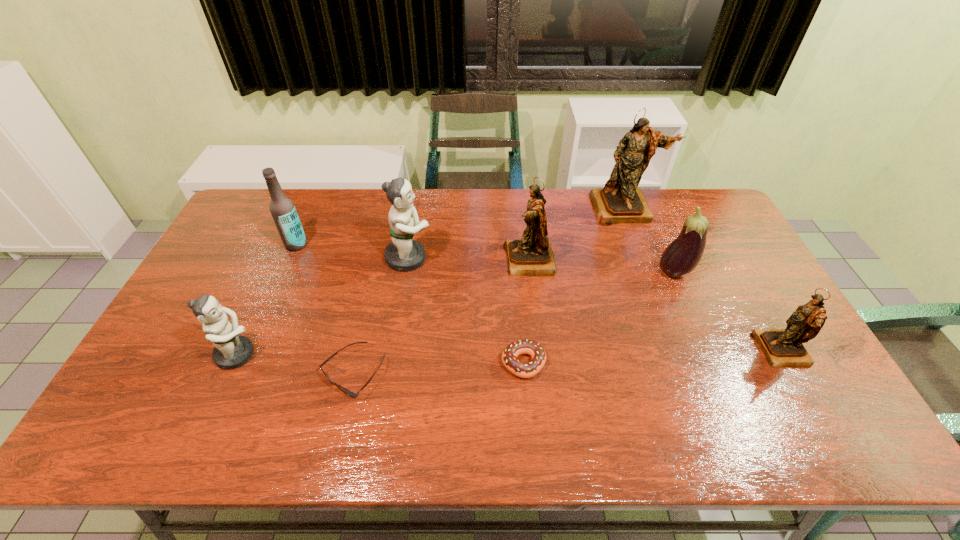
Where is `the farthest figurine`? This screenshot has height=540, width=960. the farthest figurine is located at coordinates (621, 200).

This screenshot has height=540, width=960. In order to click on the second figurine from right to left in this screenshot , I will do `click(621, 200)`.

This screenshot has height=540, width=960. Identify the location of the right green figurine. (403, 254).

In order to click on the bigger green figurine in this screenshot , I will do `click(403, 254)`.

You are a GUI agent. You are given a task and a screenshot of the screen. Output one action in this format:
    pyautogui.click(x=<x>, y=<y>)
    Task: Click on the second smallest gold figurine
    Image resolution: width=960 pixels, height=540 pixels.
    Given the screenshot: What is the action you would take?
    pyautogui.click(x=532, y=255)

Where is `the second nearest gold figurine`? The image size is (960, 540). the second nearest gold figurine is located at coordinates (532, 255).

At what (x,y) coordinates should I click in order to perform the action: click on beer bottle. Please return your answer as a coordinate pair (x, y). Looking at the image, I should click on (282, 209).

Locate an element on the screen. eggplant is located at coordinates tap(681, 256).

Where is `the nearest gold figurine`? the nearest gold figurine is located at coordinates (782, 347).

Where is `the rightmost figurine`? This screenshot has height=540, width=960. the rightmost figurine is located at coordinates (782, 347).